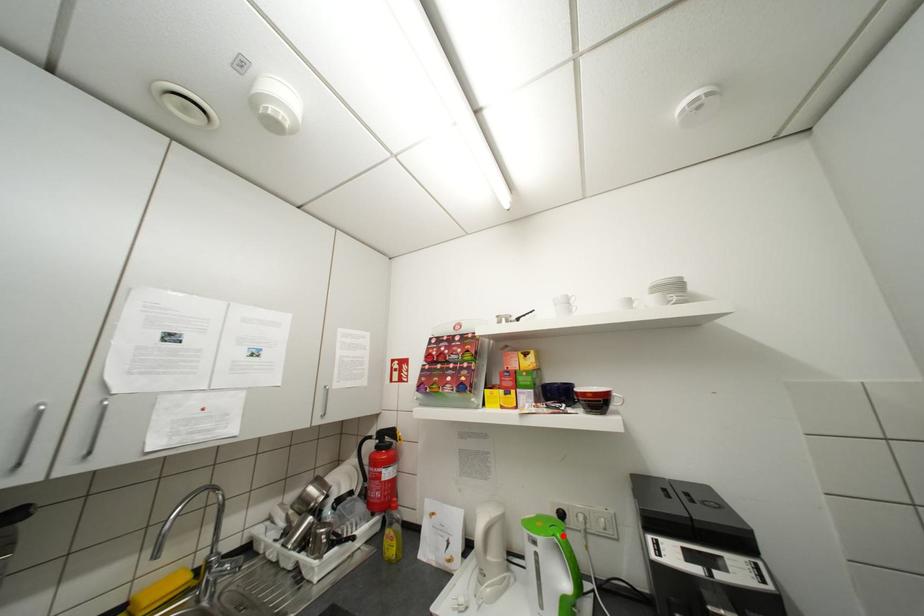
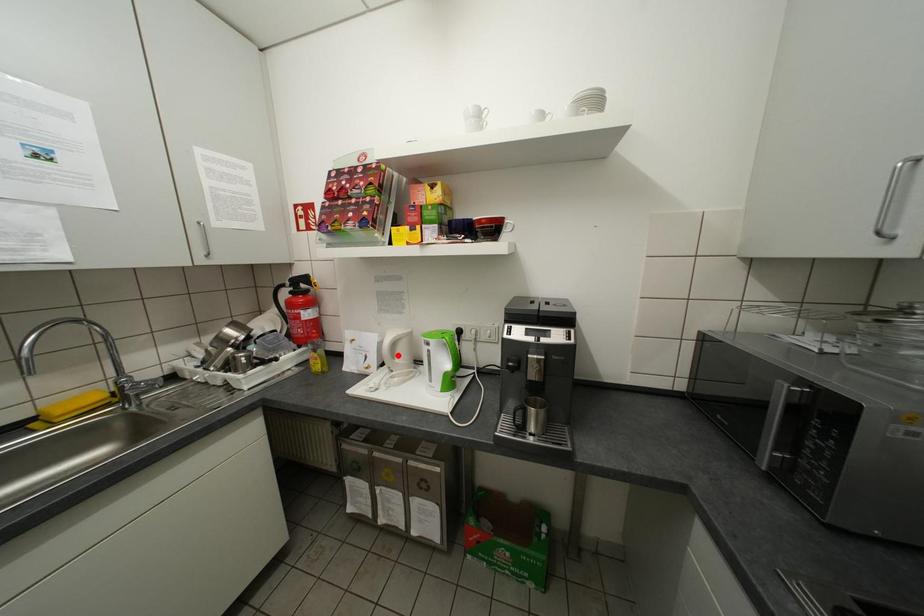
I am providing you with two images of the same scene from different viewpoints. A red point is marked on the first image and another point is marked on the second image. Do the highlighted points in image1 and image2 indicate the same real-world spot?

No